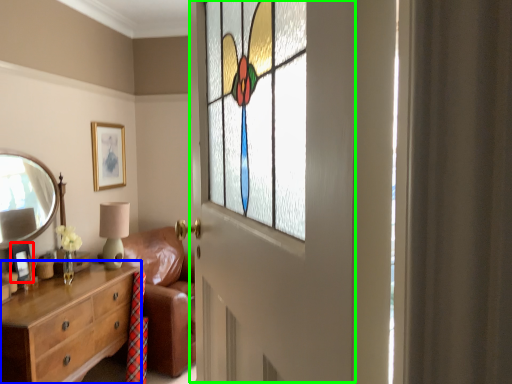
Question: Which object is positioned closest to picture frame (highlighted by a red box)? Select from chest of drawers (highlighted by a blue box) and screen door (highlighted by a green box).

Choices:
 (A) chest of drawers
 (B) screen door

Answer: (A)